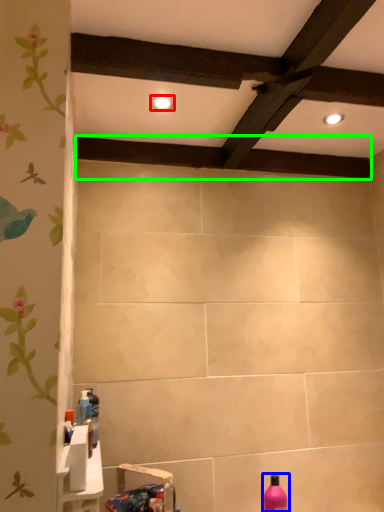
Question: Which object is the closest to the lighting (highlighted by a red box)? Choose among these: bottle (highlighted by a blue box) or plank (highlighted by a green box).

Choices:
 (A) bottle
 (B) plank

Answer: (B)